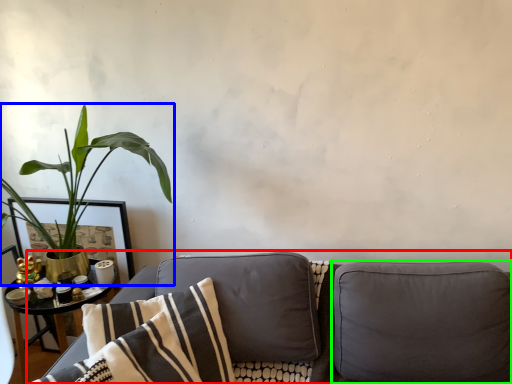
Question: Which object is positioned farthest from studio couch (highlighted by a red box)? Select from houseplant (highlighted by a blue box) and pillow (highlighted by a green box).

Choices:
 (A) houseplant
 (B) pillow

Answer: (A)